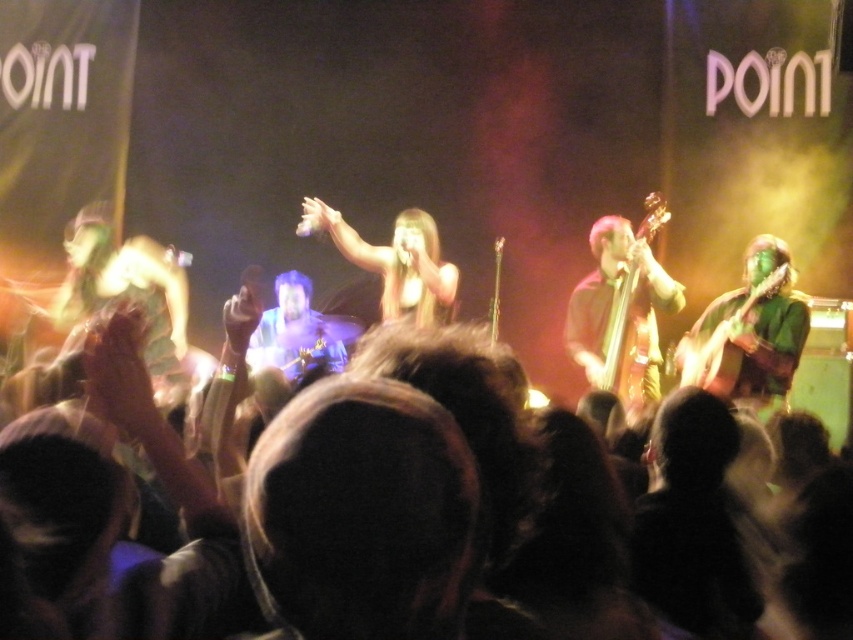
Which is more to the right, shiny gold microphone at center or wooden electric bass at center right?

wooden electric bass at center right is more to the right.

Consider the image. Between shiny gold microphone at center and wooden electric bass at center right, which one is positioned lower?

wooden electric bass at center right is lower down.

Is point (386, 280) farther from camera compared to point (648, 312)?

Yes.

Find the location of a particular element. shiny gold microphone at center is located at coordinates (395, 260).

Which is in front, point (646, 205) or point (769, 278)?

Point (769, 278) is in front.

Between wooden electric bass at center right and green matte guitar at right, which one appears on the left side from the viewer's perspective?

Positioned to the left is wooden electric bass at center right.

Is point (643, 356) positioned after point (682, 362)?

No, (643, 356) is closer to viewer.

Locate an element on the screen. The height and width of the screenshot is (640, 853). wooden electric bass at center right is located at coordinates (618, 330).

Where is `shiny gold microphone at center`? shiny gold microphone at center is located at coordinates (395, 260).

Which of these two, shiny gold microphone at center or green matte guitar at right, stands taller?

With more height is green matte guitar at right.

Find the location of `shiny gold microphone at center`. shiny gold microphone at center is located at coordinates (395, 260).

This screenshot has width=853, height=640. Identify the location of shiny gold microphone at center. (395, 260).